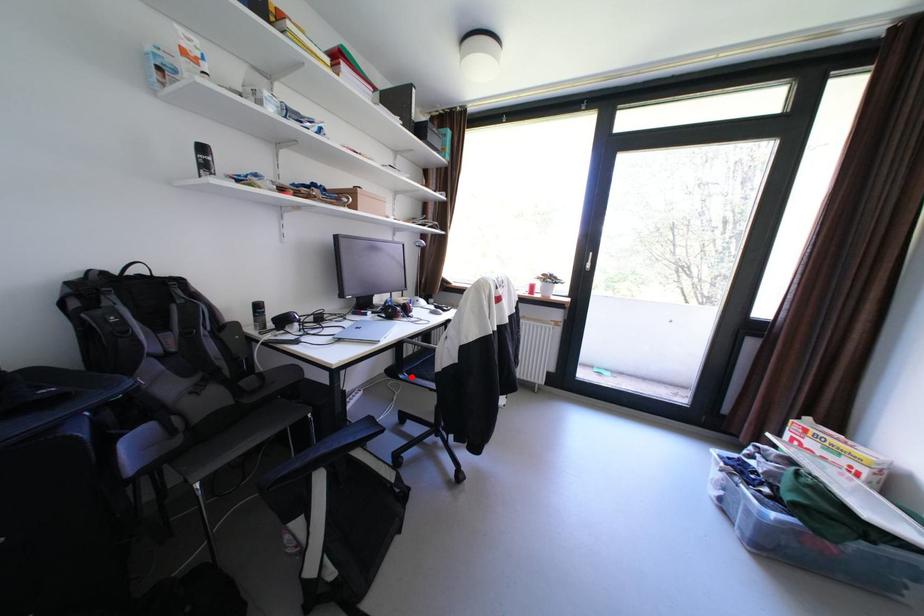
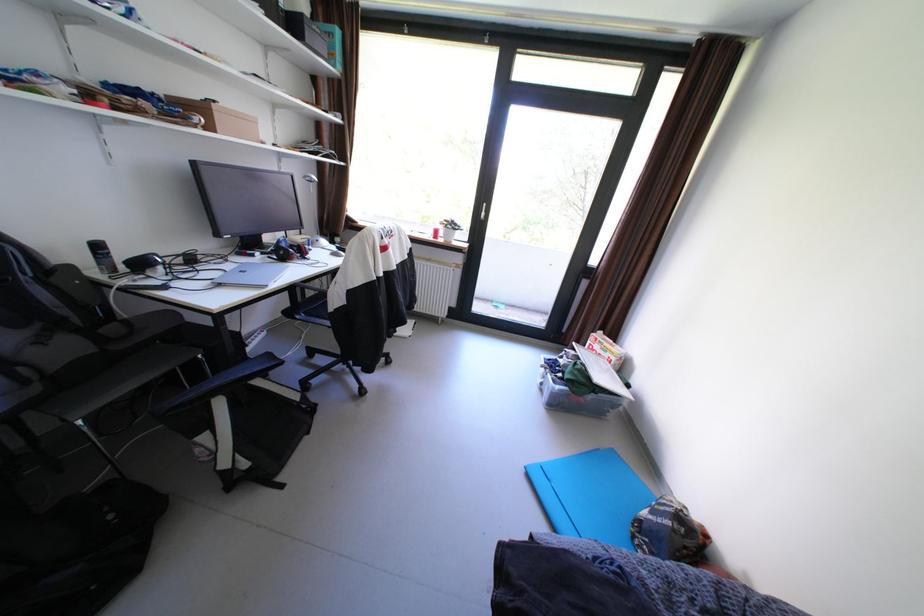
In the second image, find the point that corresponds to the highlighted location in the first image.

(309, 317)